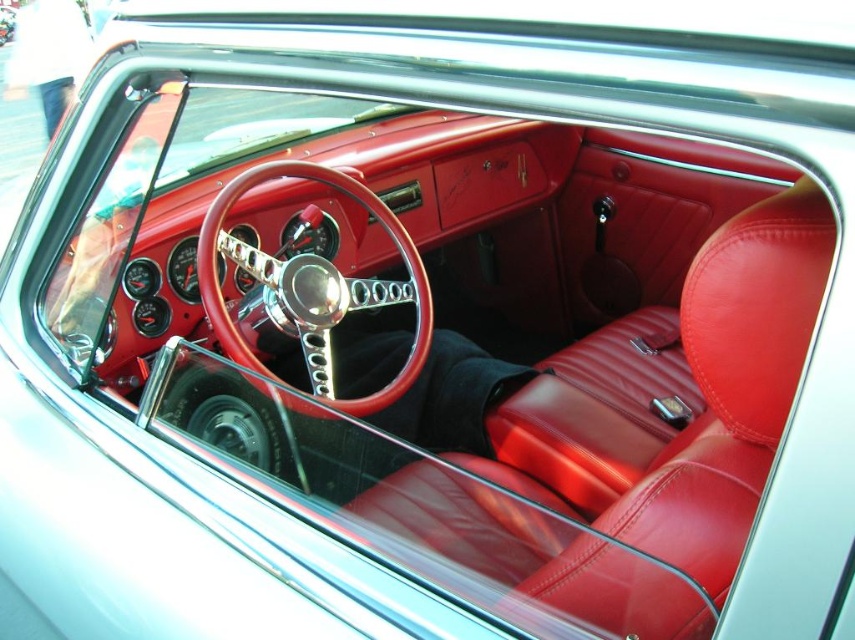
Question: Observing the image, what is the correct spatial positioning of shiny red leather steering wheel at center in reference to metallic silver wheel at center?

Choices:
 (A) left
 (B) right

Answer: (B)

Question: Which point is closer to the camera?

Choices:
 (A) (422, 342)
 (B) (222, 369)

Answer: (B)

Question: Observing the image, what is the correct spatial positioning of shiny red leather steering wheel at center in reference to metallic silver wheel at center?

Choices:
 (A) below
 (B) above

Answer: (B)

Question: Which point is closer to the camera taking this photo?

Choices:
 (A) (211, 294)
 (B) (175, 378)

Answer: (B)

Question: Can you confirm if shiny red leather steering wheel at center is positioned above metallic silver wheel at center?

Choices:
 (A) yes
 (B) no

Answer: (A)